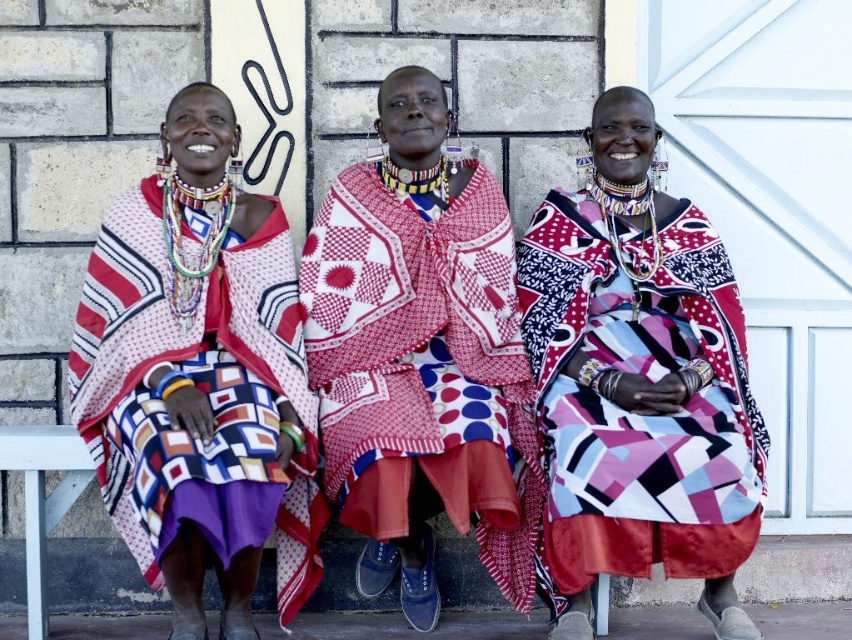
Question: Does patterned fabric dress at center appear on the left side of geometric-patterned fabric at left?

Choices:
 (A) no
 (B) yes

Answer: (A)

Question: Estimate the real-world distances between objects in this image. Which object is closer to the geometric-patterned fabric at center?

Choices:
 (A) geometric-patterned fabric at left
 (B) patterned fabric dress at center

Answer: (B)

Question: Which of these objects is positioned farthest from the geometric-patterned fabric at center?

Choices:
 (A) geometric-patterned fabric at left
 (B) patterned fabric dress at center

Answer: (A)

Question: Is patterned fabric dress at center smaller than geometric-patterned fabric at center?

Choices:
 (A) no
 (B) yes

Answer: (A)

Question: Can you confirm if geometric-patterned fabric at center is positioned above geometric-patterned fabric at left?

Choices:
 (A) yes
 (B) no

Answer: (B)

Question: Among these objects, which one is farthest from the camera?

Choices:
 (A) geometric-patterned fabric at center
 (B) patterned fabric dress at center
 (C) geometric-patterned fabric at left

Answer: (C)